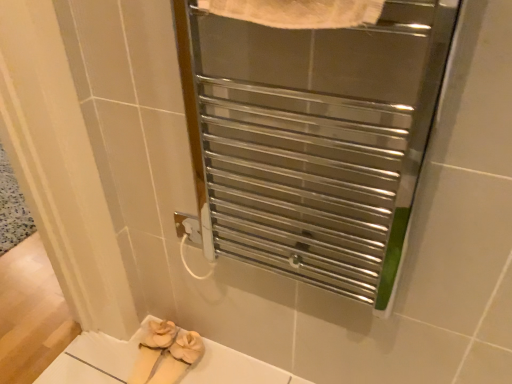
Question: Is point (161, 345) closer or farther from the camera than point (310, 132)?

Choices:
 (A) closer
 (B) farther

Answer: (B)

Question: Is white soft slippers at lower center taller or shorter than polished metal towel warmer at upper center?

Choices:
 (A) tall
 (B) short

Answer: (B)

Question: Is white soft slippers at lower center situated inside polished metal towel warmer at upper center or outside?

Choices:
 (A) inside
 (B) outside

Answer: (B)

Question: Is polished metal towel warmer at upper center taller or shorter than white soft slippers at lower center?

Choices:
 (A) tall
 (B) short

Answer: (A)

Question: From the image's perspective, is polished metal towel warmer at upper center located above or below white soft slippers at lower center?

Choices:
 (A) above
 (B) below

Answer: (A)

Question: Is point (369, 43) positioned closer to the camera than point (168, 352)?

Choices:
 (A) closer
 (B) farther

Answer: (A)

Question: Is polished metal towel warmer at upper center wider or thinner than white soft slippers at lower center?

Choices:
 (A) wide
 (B) thin

Answer: (B)